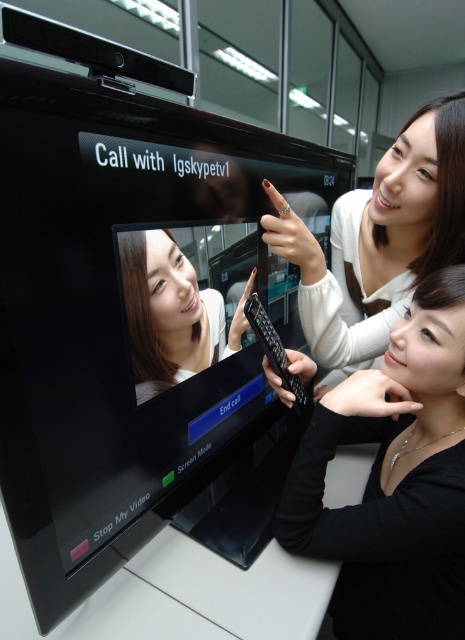
Question: Is matte black remote control at center wider than smooth skin face at center?

Choices:
 (A) yes
 (B) no

Answer: (A)

Question: Which point is closer to the camera?

Choices:
 (A) (180, 348)
 (B) (416, 332)
 (C) (298, 396)
 (D) (386, 225)

Answer: (A)

Question: Based on their relative distances, which object is nearer to the smooth skin face at center?

Choices:
 (A) matte black remote control at center
 (B) black matte remote control at center
 (C) black plastic remote at lower right

Answer: (C)

Question: Can you confirm if smooth skin face at center is bigger than black plastic remote at lower right?

Choices:
 (A) no
 (B) yes

Answer: (A)

Question: Which of these objects is positioned closest to the smooth skin face at center?

Choices:
 (A) matte black remote control at center
 (B) black matte remote control at center

Answer: (A)

Question: From the image, what is the correct spatial relationship of smooth skin face at center in relation to black plastic remote at lower right?

Choices:
 (A) below
 (B) above

Answer: (B)